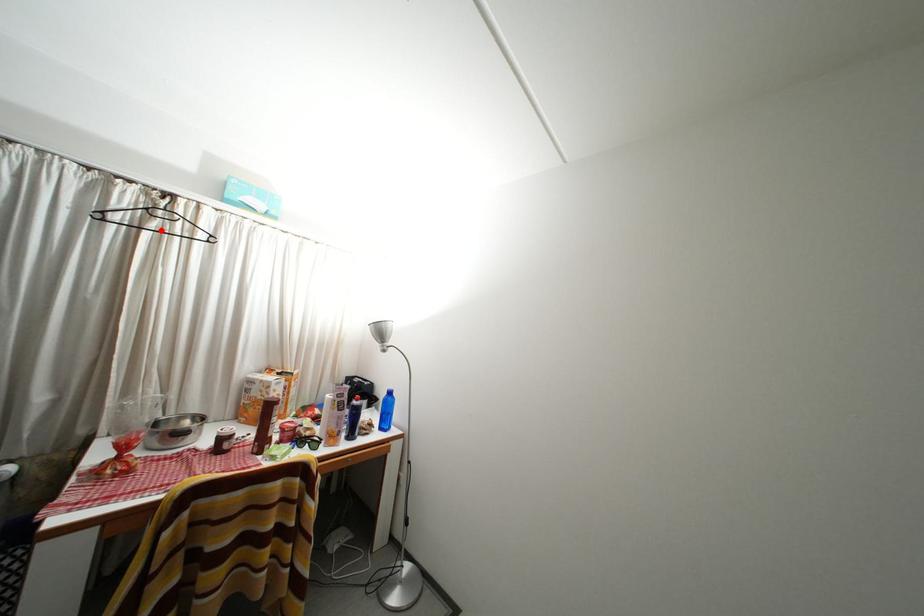
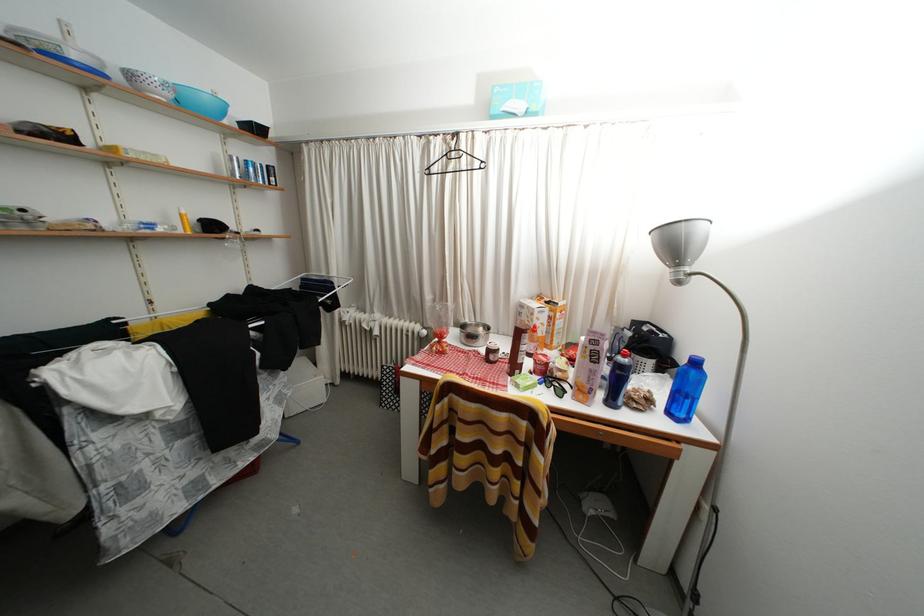
Find the pixel in the second image that matches the highlighted location in the first image.

(458, 172)